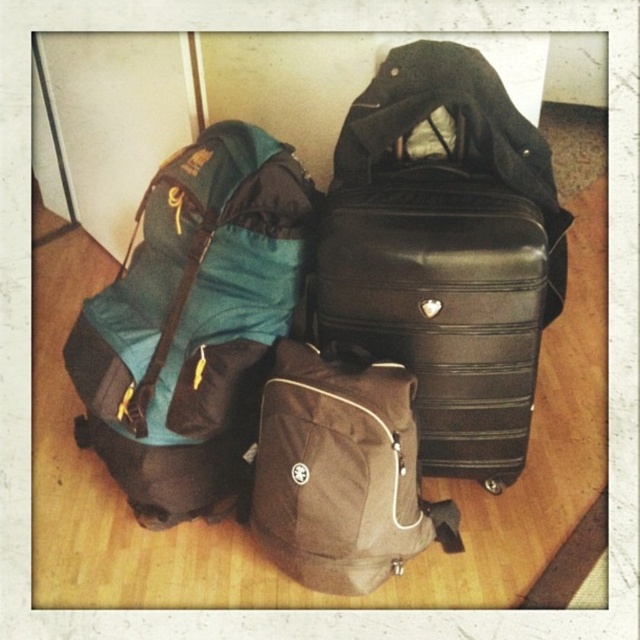
You are packing for a trip and need to choose between the teal fabric backpack at left and the black hardshell suitcase at center. Which one has a greater height?

The teal fabric backpack at left is much taller than the black hardshell suitcase at center, so the teal fabric backpack at left has a greater height.

You are packing for a trip and need to place your teal fabric backpack at left and brown fabric backpack at center into a storage compartment that is 25 centimeters wide. Will both fit side by side without overlapping?

The teal fabric backpack at left is 22.78 centimeters away from brown fabric backpack at center, so they can fit side by side in the 25 centimeter wide compartment since the total distance between them is less than the compartment width.

You are packing for a hiking trip and need to choose between the teal fabric backpack at left and the brown fabric backpack at center. Which one can hold more gear based on their sizes?

The teal fabric backpack at left has a larger size compared to the brown fabric backpack at center, so it can hold more gear.